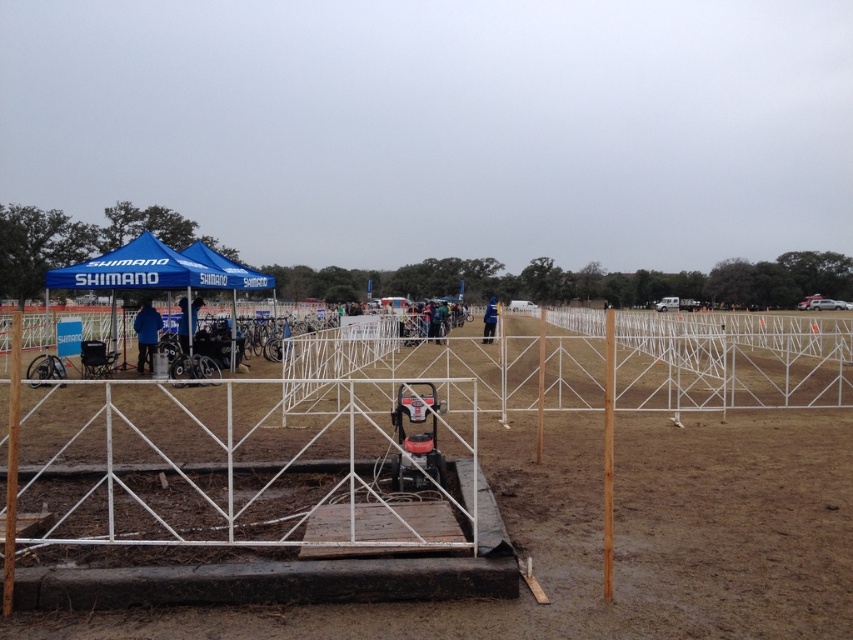
You are a photographer setting up equipment for an event. You need to place a tripod on the brown dirt field at center so it faces the blue fabric canopy at upper left. Based on their positions, will the tripod be to the left or right of the canopy?

The brown dirt field at center is positioned on the right side of the blue fabric canopy at upper left, so the tripod placed on the brown dirt field at center will be to the right of the canopy.